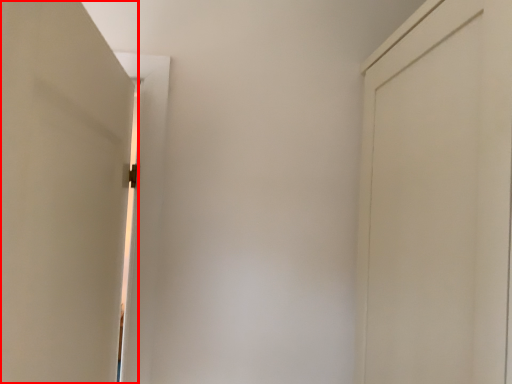
Question: From the image's perspective, considering the relative positions of door (annotated by the red box) and door in the image provided, where is door (annotated by the red box) located with respect to the staircase?

Choices:
 (A) above
 (B) below

Answer: (B)